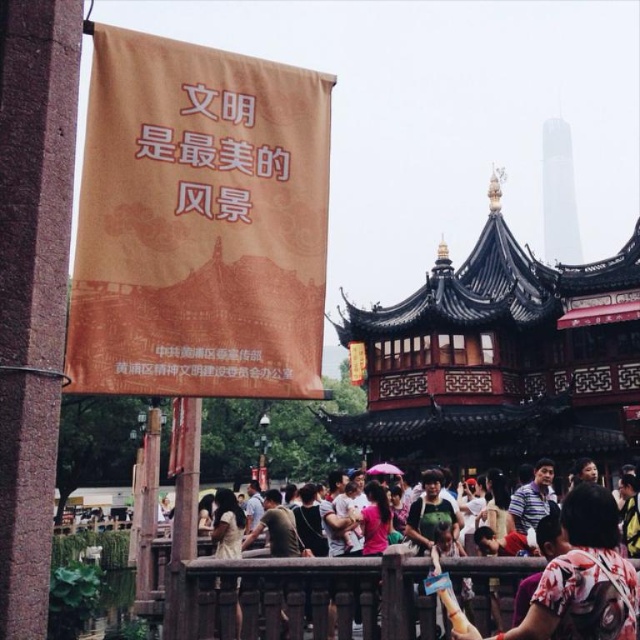
Is light yellow fabric at center taller than matte pink shirt at center?

Correct, light yellow fabric at center is much taller as matte pink shirt at center.

Does point (212, 538) lie behind point (492, 492)?

No, (212, 538) is in front of (492, 492).

Locate an element on the screen. The height and width of the screenshot is (640, 640). light yellow fabric at center is located at coordinates (227, 525).